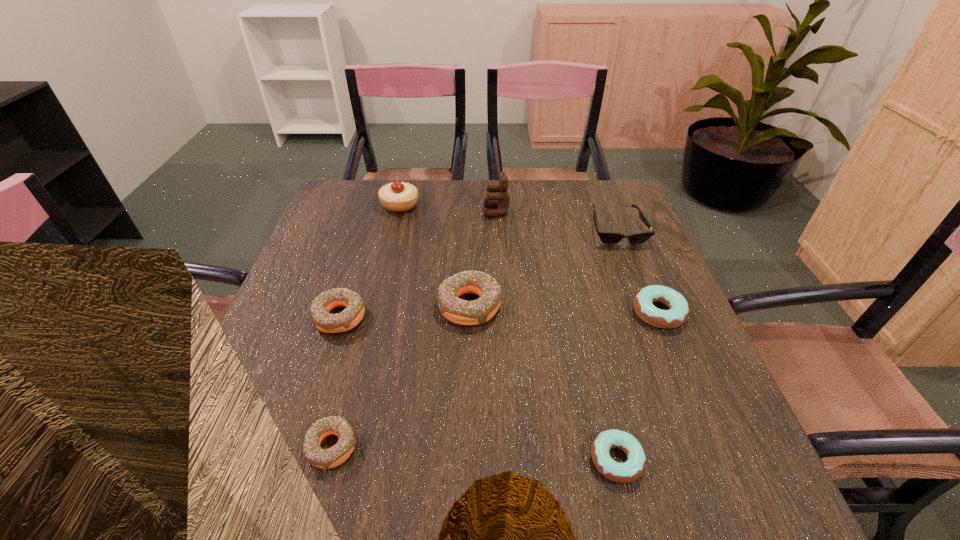
The image size is (960, 540). In order to click on free space between the pastry and the nearer blue doughnut in this screenshot , I will do `click(508, 332)`.

In order to click on empty space that is in between the rightmost doughnut and the second tallest object in this screenshot , I will do `click(529, 259)`.

The image size is (960, 540). I want to click on free space between the teddy bear and the rightmost chocolate doughnut, so click(x=483, y=258).

Where is `free space between the second smallest chocolate doughnut and the teddy bear`? The height and width of the screenshot is (540, 960). free space between the second smallest chocolate doughnut and the teddy bear is located at coordinates (418, 264).

Locate an element on the screen. This screenshot has width=960, height=540. empty space between the third object from right to left and the nearest chocolate doughnut is located at coordinates (474, 453).

Identify the location of vacant point located between the smaller blue doughnut and the third doughnut from right to left. Image resolution: width=960 pixels, height=540 pixels. (543, 382).

Choose which object is the second nearest neighbor to the beige pastry. Please provide its 2D coordinates. Your answer should be formatted as a tuple, i.e. [(x, y)], where the tuple contains the x and y coordinates of a point satisfying the conditions above.

[(459, 311)]

At what (x,y) coordinates should I click in order to perform the action: click on the sixth closest object to the sunglasses. Please return your answer as a coordinate pair (x, y). The height and width of the screenshot is (540, 960). Looking at the image, I should click on (351, 316).

Identify which doughnut is the second nearest to the second doughnut from right to left. Please provide its 2D coordinates. Your answer should be formatted as a tuple, i.e. [(x, y)], where the tuple contains the x and y coordinates of a point satisfying the conditions above.

[(459, 311)]

Where is `doughnut that stands as the third closest to the second smallest chocolate doughnut`? This screenshot has height=540, width=960. doughnut that stands as the third closest to the second smallest chocolate doughnut is located at coordinates (633, 468).